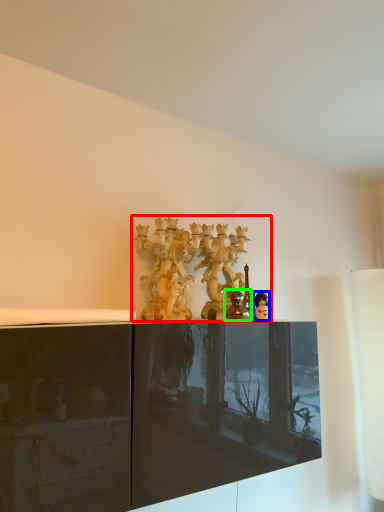
Question: Estimate the real-world distances between objects in this image. Which object is farther from collection (highlighted by a red box), person (highlighted by a blue box) or figurine (highlighted by a green box)?

Choices:
 (A) person
 (B) figurine

Answer: (A)